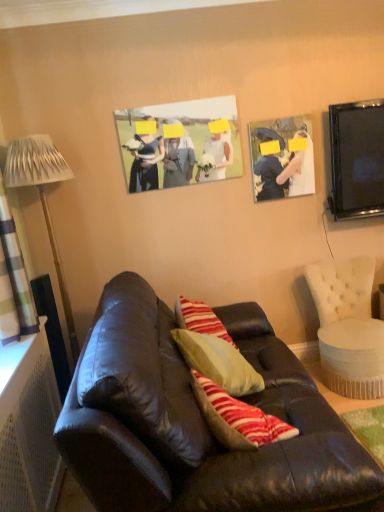
Question: Is plaid fabric curtain at left wider than matte black photo frame at upper right, which appears as the second picture frame when viewed from the left?

Choices:
 (A) yes
 (B) no

Answer: (A)

Question: Is the depth of plaid fabric curtain at left greater than that of matte black photo frame at upper right, arranged as the 1th picture frame when viewed from the right?

Choices:
 (A) yes
 (B) no

Answer: (B)

Question: Can you confirm if plaid fabric curtain at left is smaller than matte black photo frame at upper right, arranged as the 1th picture frame when viewed from the right?

Choices:
 (A) yes
 (B) no

Answer: (B)

Question: Could you tell me if plaid fabric curtain at left is facing matte black photo frame at upper right, arranged as the 1th picture frame when viewed from the right?

Choices:
 (A) yes
 (B) no

Answer: (B)

Question: Is plaid fabric curtain at left taller than matte black photo frame at upper right, which appears as the second picture frame when viewed from the left?

Choices:
 (A) no
 (B) yes

Answer: (B)

Question: Based on their positions, is matte paper photo at center, the second picture frame from the right, located to the left or right of metallic silver lamp at left?

Choices:
 (A) right
 (B) left

Answer: (A)

Question: Is matte paper photo at center, arranged as the 1th picture frame when viewed from the left, wider or thinner than metallic silver lamp at left?

Choices:
 (A) wide
 (B) thin

Answer: (B)

Question: Do you think matte paper photo at center, arranged as the 1th picture frame when viewed from the left, is within metallic silver lamp at left, or outside of it?

Choices:
 (A) outside
 (B) inside

Answer: (A)

Question: Considering the positions of matte paper photo at center, arranged as the 1th picture frame when viewed from the left, and metallic silver lamp at left in the image, is matte paper photo at center, arranged as the 1th picture frame when viewed from the left, bigger or smaller than metallic silver lamp at left?

Choices:
 (A) big
 (B) small

Answer: (B)

Question: Is point (352, 480) positioned closer to the camera than point (137, 158)?

Choices:
 (A) closer
 (B) farther

Answer: (A)

Question: Considering their positions, is matte black couch at center located in front of or behind matte paper photo at center, the second picture frame from the right?

Choices:
 (A) front
 (B) behind

Answer: (A)

Question: Do you think matte black couch at center is within matte paper photo at center, arranged as the 1th picture frame when viewed from the left, or outside of it?

Choices:
 (A) outside
 (B) inside

Answer: (A)

Question: Considering the positions of matte black couch at center and matte paper photo at center, arranged as the 1th picture frame when viewed from the left, in the image, is matte black couch at center bigger or smaller than matte paper photo at center, arranged as the 1th picture frame when viewed from the left,?

Choices:
 (A) big
 (B) small

Answer: (A)

Question: Based on their positions, is metallic silver lamp at left located to the left or right of matte paper photo at center, arranged as the 1th picture frame when viewed from the left?

Choices:
 (A) right
 (B) left

Answer: (B)

Question: Considering the positions of point (14, 181) and point (180, 147), is point (14, 181) closer or farther from the camera than point (180, 147)?

Choices:
 (A) closer
 (B) farther

Answer: (A)